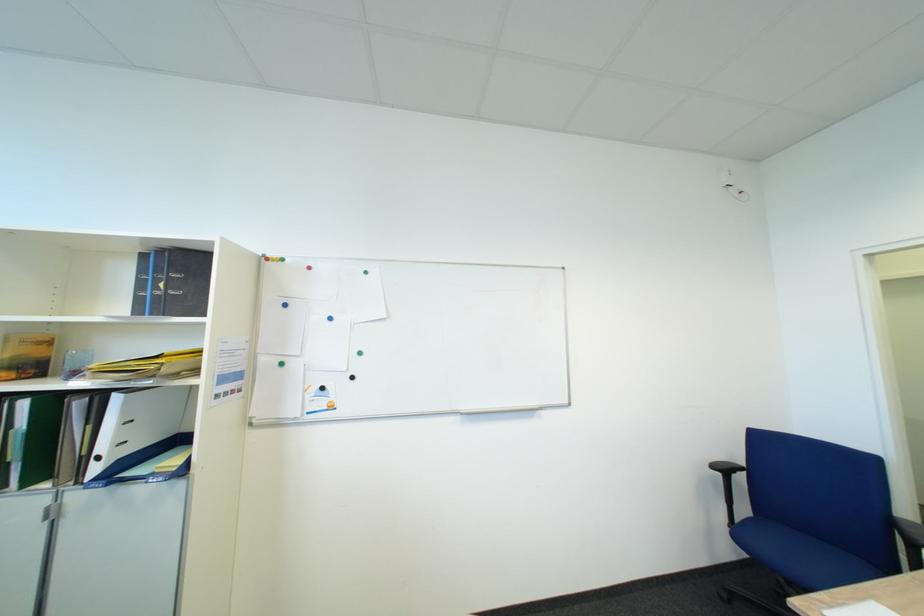
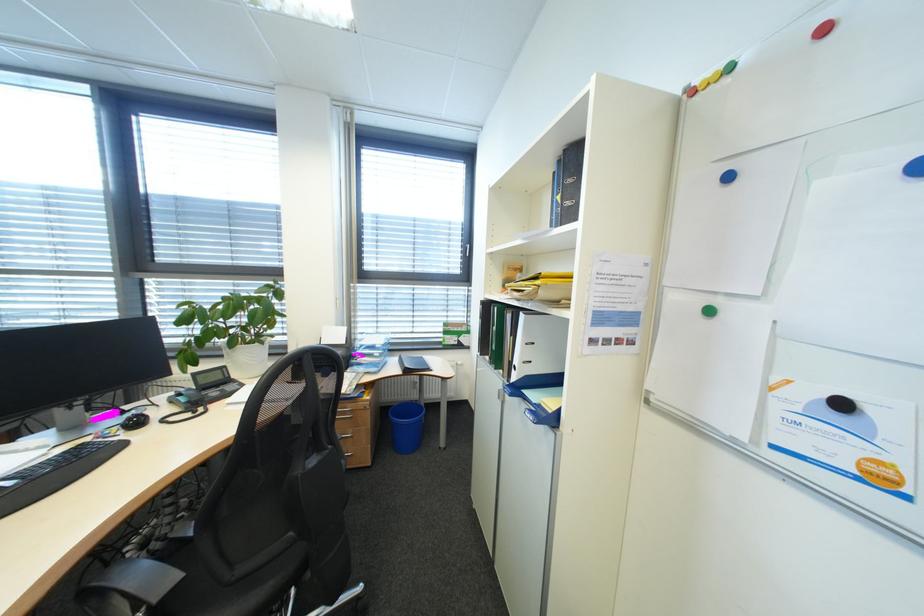
The point at (333, 390) is marked in the first image. Where is the corresponding point in the second image?

(854, 406)